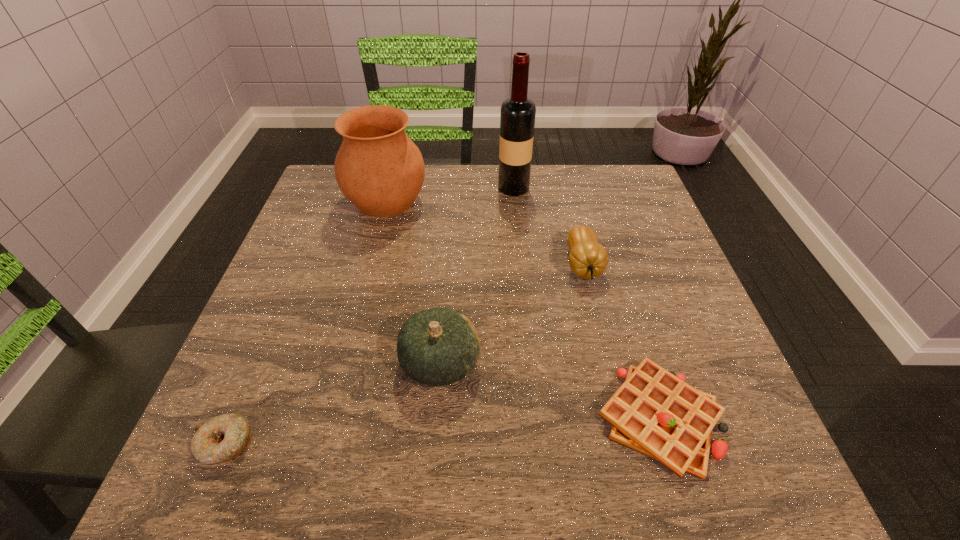
Locate an element on the screen. the tallest object is located at coordinates (517, 118).

At what (x,y) coordinates should I click in order to perform the action: click on wine bottle. Please return your answer as a coordinate pair (x, y). The width and height of the screenshot is (960, 540). Looking at the image, I should click on (517, 118).

At what (x,y) coordinates should I click in order to perform the action: click on pottery. Please return your answer as a coordinate pair (x, y). This screenshot has width=960, height=540. Looking at the image, I should click on (379, 169).

The width and height of the screenshot is (960, 540). What are the coordinates of `the taller gourd` in the screenshot? It's located at (436, 347).

Find the location of a particular element. This screenshot has height=540, width=960. the fourth shortest object is located at coordinates (436, 347).

Identify the location of the third farthest object. The height and width of the screenshot is (540, 960). (588, 259).

Where is `the third shortest object`? Image resolution: width=960 pixels, height=540 pixels. the third shortest object is located at coordinates (588, 259).

This screenshot has height=540, width=960. What are the coordinates of `the second shortest object` in the screenshot? It's located at (654, 412).

At what (x,y) coordinates should I click in order to perform the action: click on the leftmost object. Please return your answer as a coordinate pair (x, y). Looking at the image, I should click on click(x=223, y=438).

You are a GUI agent. You are given a task and a screenshot of the screen. Output one action in this format:
    pyautogui.click(x=<x>, y=<y>)
    Task: Click on the doughnut
    The width and height of the screenshot is (960, 540).
    Given the screenshot: What is the action you would take?
    pyautogui.click(x=223, y=438)